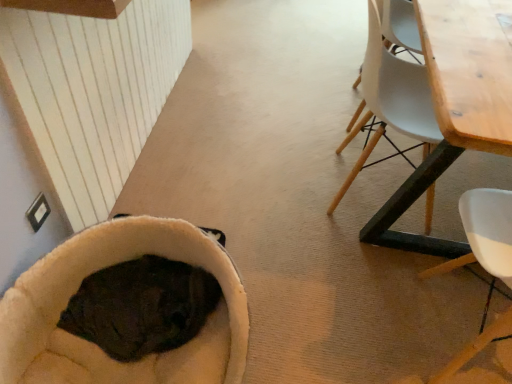
Question: Is wooden table at right positioned far away from wooden chair at right?

Choices:
 (A) no
 (B) yes

Answer: (A)

Question: From the image's perspective, is wooden table at right over wooden chair at right?

Choices:
 (A) no
 (B) yes

Answer: (B)

Question: Is wooden chair at right inside wooden table at right?

Choices:
 (A) no
 (B) yes

Answer: (B)

Question: Is wooden table at right aimed at wooden chair at right?

Choices:
 (A) yes
 (B) no

Answer: (B)

Question: From the image's perspective, is wooden table at right below wooden chair at right?

Choices:
 (A) yes
 (B) no

Answer: (B)

Question: From a real-world perspective, is soft beige bean bag at lower left positioned above or below wooden chair at right?

Choices:
 (A) below
 (B) above

Answer: (A)

Question: In the image, is soft beige bean bag at lower left on the left side or the right side of wooden chair at right?

Choices:
 (A) right
 (B) left

Answer: (B)

Question: Considering the positions of soft beige bean bag at lower left and wooden chair at right in the image, is soft beige bean bag at lower left taller or shorter than wooden chair at right?

Choices:
 (A) tall
 (B) short

Answer: (B)

Question: In terms of size, does soft beige bean bag at lower left appear bigger or smaller than wooden chair at right?

Choices:
 (A) big
 (B) small

Answer: (B)

Question: Considering the positions of soft beige bean bag at lower left and wooden table at right in the image, is soft beige bean bag at lower left taller or shorter than wooden table at right?

Choices:
 (A) tall
 (B) short

Answer: (B)

Question: Is point (189, 362) closer or farther from the camera than point (375, 231)?

Choices:
 (A) closer
 (B) farther

Answer: (A)

Question: From a real-world perspective, is soft beige bean bag at lower left physically located above or below wooden table at right?

Choices:
 (A) below
 (B) above

Answer: (A)

Question: Is soft beige bean bag at lower left bigger or smaller than wooden table at right?

Choices:
 (A) small
 (B) big

Answer: (A)

Question: In the image, is wooden table at right on the left side or the right side of wooden chair at right?

Choices:
 (A) right
 (B) left

Answer: (A)

Question: Is point (455, 49) closer or farther from the camera than point (480, 329)?

Choices:
 (A) closer
 (B) farther

Answer: (A)